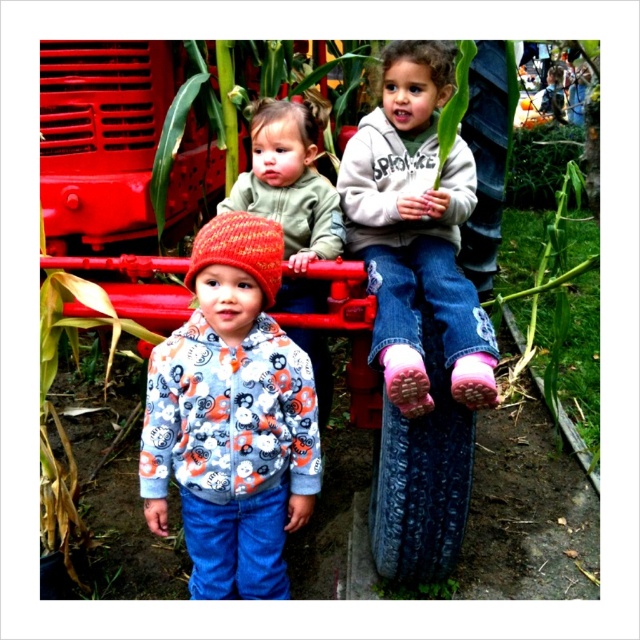
Between pink fuzzy socks at center and knitted wool hat at center, which one is positioned lower?

Positioned lower is knitted wool hat at center.

Does pink fuzzy socks at center have a larger size compared to knitted wool hat at center?

Actually, pink fuzzy socks at center might be smaller than knitted wool hat at center.

Is point (435, 125) positioned before point (323, 192)?

No, (435, 125) is further to viewer.

Identify the location of pink fuzzy socks at center. (416, 230).

The image size is (640, 640). What do you see at coordinates (230, 417) in the screenshot?
I see `knitted woolen hat at center` at bounding box center [230, 417].

Does knitted woolen hat at center have a greater height compared to pink fuzzy socks at center?

Indeed, knitted woolen hat at center has a greater height compared to pink fuzzy socks at center.

Who is more forward, (x=182, y=337) or (x=384, y=202)?

Point (x=182, y=337)

Locate an element on the screen. The height and width of the screenshot is (640, 640). knitted woolen hat at center is located at coordinates (230, 417).

From the picture: How distant is knitted woolen hat at center from knitted wool hat at center?

knitted woolen hat at center is 11.81 inches away from knitted wool hat at center.

Can you confirm if knitted woolen hat at center is smaller than knitted wool hat at center?

Indeed, knitted woolen hat at center has a smaller size compared to knitted wool hat at center.

Identify the location of knitted woolen hat at center. This screenshot has width=640, height=640. (230, 417).

At what (x,y) coordinates should I click in order to perform the action: click on knitted woolen hat at center. Please return your answer as a coordinate pair (x, y). Looking at the image, I should click on (230, 417).